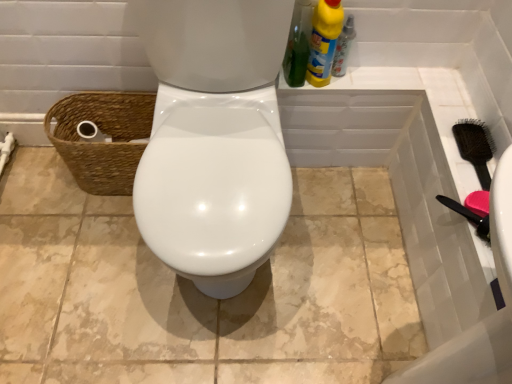
Locate an element on the screen. yellow plastic bottle at upper right is located at coordinates (343, 48).

In order to face yellow plastic bottle at upper right, placed as the first cleaning product when sorted from right to left, should I rotate leftwards or rightwards?

You should look right and rotate roughly 9.070 degrees.

Measure the distance between yellow plastic bottle at upper right, placed as the 2th cleaning product when sorted from left to right, and camera.

yellow plastic bottle at upper right, placed as the 2th cleaning product when sorted from left to right, and camera are 1.06 meters apart from each other.

The width and height of the screenshot is (512, 384). Describe the element at coordinates (298, 44) in the screenshot. I see `yellow liquid cleaner at upper right, which is the first cleaning product in left-to-right order` at that location.

You are a GUI agent. You are given a task and a screenshot of the screen. Output one action in this format:
    pyautogui.click(x=<x>, y=<y>)
    Task: Click on the yellow plastic bottle at upper right
    This screenshot has width=512, height=384.
    Given the screenshot: What is the action you would take?
    pyautogui.click(x=343, y=48)

Is yellow liquid cleaner at upper right, which is the first cleaning product in left-to-right order, oriented towards black plastic brush at right?

No, yellow liquid cleaner at upper right, which is the first cleaning product in left-to-right order, is not aimed at black plastic brush at right.

Considering the relative sizes of yellow liquid cleaner at upper right, which is the 2th cleaning product from right to left, and black plastic brush at right in the image provided, is yellow liquid cleaner at upper right, which is the 2th cleaning product from right to left, bigger than black plastic brush at right?

Yes, yellow liquid cleaner at upper right, which is the 2th cleaning product from right to left, is bigger than black plastic brush at right.

Would you say yellow liquid cleaner at upper right, which is the first cleaning product in left-to-right order, contains black plastic brush at right?

No, black plastic brush at right is not a part of yellow liquid cleaner at upper right, which is the first cleaning product in left-to-right order.

Is yellow liquid cleaner at upper right, which is the 2th cleaning product from right to left, positioned far away from black plastic brush at right?

No, there isn't a large distance between yellow liquid cleaner at upper right, which is the 2th cleaning product from right to left, and black plastic brush at right.

In the scene shown: Considering the positions of objects brown woven basket at left and yellow plastic bottle at upper right, placed as the first cleaning product when sorted from right to left, in the image provided, who is more to the left, brown woven basket at left or yellow plastic bottle at upper right, placed as the first cleaning product when sorted from right to left,?

From the viewer's perspective, brown woven basket at left appears more on the left side.

What's the angular difference between brown woven basket at left and yellow plastic bottle at upper right, placed as the first cleaning product when sorted from right to left,'s facing directions?

There is a 0.00104-degree angle between the facing directions of brown woven basket at left and yellow plastic bottle at upper right, placed as the first cleaning product when sorted from right to left.

In the scene shown: Does brown woven basket at left have a smaller size compared to yellow plastic bottle at upper right, placed as the 2th cleaning product when sorted from left to right?

Incorrect, brown woven basket at left is not smaller in size than yellow plastic bottle at upper right, placed as the 2th cleaning product when sorted from left to right.

Could yellow plastic bottle at upper right, placed as the 2th cleaning product when sorted from left to right, be considered to be inside brown woven basket at left?

No, yellow plastic bottle at upper right, placed as the 2th cleaning product when sorted from left to right, is located outside of brown woven basket at left.

Is yellow plastic bottle at upper right taller than yellow liquid cleaner at upper right, which is the 2th cleaning product from right to left?

No.

The width and height of the screenshot is (512, 384). What are the coordinates of `cleaning product that is the 2nd object located in front of the yellow plastic bottle at upper right` in the screenshot? It's located at (298, 44).

Is yellow plastic bottle at upper right bigger than yellow liquid cleaner at upper right, which is the first cleaning product in left-to-right order?

Actually, yellow plastic bottle at upper right might be smaller than yellow liquid cleaner at upper right, which is the first cleaning product in left-to-right order.

Measure the distance between yellow plastic bottle at upper right and yellow liquid cleaner at upper right, which is the 2th cleaning product from right to left.

yellow plastic bottle at upper right is 4.17 inches from yellow liquid cleaner at upper right, which is the 2th cleaning product from right to left.

What's the angular difference between brown woven basket at left and black plastic brush at right's facing directions?

The angle between the facing direction of brown woven basket at left and the facing direction of black plastic brush at right is 90.3 degrees.

From the image's perspective, which object appears higher, brown woven basket at left or black plastic brush at right?

From the image's view, brown woven basket at left is above.

Identify the location of brush located below the brown woven basket at left (from the image's perspective). (475, 147).

Who is taller, brown woven basket at left or black plastic brush at right?

brown woven basket at left.

Is black plastic brush at right positioned with its back to yellow plastic bottle at upper right?

No, black plastic brush at right is not facing the opposite direction of yellow plastic bottle at upper right.

Which is behind, point (475, 148) or point (335, 50)?

Positioned behind is point (335, 50).

Is black plastic brush at right situated inside yellow plastic bottle at upper right or outside?

black plastic brush at right is outside yellow plastic bottle at upper right.

Does brown woven basket at left appear on the right side of yellow plastic bottle at upper right?

No.

Between point (99, 105) and point (340, 64), which one is positioned in front?

Positioned in front is point (340, 64).

From the image's perspective, which object appears higher, brown woven basket at left or yellow plastic bottle at upper right?

yellow plastic bottle at upper right is shown above in the image.

From a real-world perspective, which is physically below, brown woven basket at left or yellow plastic bottle at upper right?

brown woven basket at left, from a real-world perspective.

Is yellow plastic bottle at upper right, placed as the first cleaning product when sorted from right to left, oriented away from yellow plastic bottle at upper right?

No, yellow plastic bottle at upper right, placed as the first cleaning product when sorted from right to left,'s orientation is not away from yellow plastic bottle at upper right.

From a real-world perspective, is yellow plastic bottle at upper right, placed as the first cleaning product when sorted from right to left, on yellow plastic bottle at upper right?

Yes, from a real-world perspective, yellow plastic bottle at upper right, placed as the first cleaning product when sorted from right to left, is above yellow plastic bottle at upper right.

Are yellow plastic bottle at upper right, placed as the 2th cleaning product when sorted from left to right, and yellow plastic bottle at upper right beside each other?

Yes, yellow plastic bottle at upper right, placed as the 2th cleaning product when sorted from left to right, is next to yellow plastic bottle at upper right.

Is yellow plastic bottle at upper right, placed as the 2th cleaning product when sorted from left to right, located outside yellow plastic bottle at upper right?

yellow plastic bottle at upper right, placed as the 2th cleaning product when sorted from left to right, is positioned outside yellow plastic bottle at upper right.

Where is `the 2nd cleaning product in front when counting from the black plastic brush at right`? This screenshot has height=384, width=512. the 2nd cleaning product in front when counting from the black plastic brush at right is located at coordinates (298, 44).

This screenshot has width=512, height=384. I want to click on basket below the yellow plastic bottle at upper right, placed as the 2th cleaning product when sorted from left to right (from the image's perspective), so click(102, 143).

Considering their positions, is yellow liquid cleaner at upper right, which is the 2th cleaning product from right to left, positioned closer to brown woven basket at left than yellow plastic bottle at upper right?

Based on the image, yellow liquid cleaner at upper right, which is the 2th cleaning product from right to left, appears to be nearer to brown woven basket at left.

Considering their positions, is black plastic brush at right positioned closer to yellow liquid cleaner at upper right, which is the 2th cleaning product from right to left, than yellow plastic bottle at upper right, placed as the 2th cleaning product when sorted from left to right?

yellow plastic bottle at upper right, placed as the 2th cleaning product when sorted from left to right, is closer to yellow liquid cleaner at upper right, which is the 2th cleaning product from right to left.

Consider the image. Considering their positions, is brown woven basket at left positioned closer to yellow plastic bottle at upper right, placed as the 2th cleaning product when sorted from left to right, than yellow liquid cleaner at upper right, which is the first cleaning product in left-to-right order?

yellow liquid cleaner at upper right, which is the first cleaning product in left-to-right order.

When comparing their distances from yellow liquid cleaner at upper right, which is the 2th cleaning product from right to left, does yellow plastic bottle at upper right or yellow plastic bottle at upper right, placed as the 2th cleaning product when sorted from left to right, seem closer?

Result: yellow plastic bottle at upper right, placed as the 2th cleaning product when sorted from left to right, is closer to yellow liquid cleaner at upper right, which is the 2th cleaning product from right to left.

Estimate the real-world distances between objects in this image. Which object is further from yellow plastic bottle at upper right, placed as the first cleaning product when sorted from right to left, yellow plastic bottle at upper right or black plastic brush at right?

black plastic brush at right is further to yellow plastic bottle at upper right, placed as the first cleaning product when sorted from right to left.

Based on their spatial positions, is brown woven basket at left or yellow plastic bottle at upper right, placed as the 2th cleaning product when sorted from left to right, closer to black plastic brush at right?

yellow plastic bottle at upper right, placed as the 2th cleaning product when sorted from left to right, lies closer to black plastic brush at right than the other object.

Based on the photo, looking at the image, which one is located closer to brown woven basket at left, yellow plastic bottle at upper right or yellow plastic bottle at upper right, placed as the 2th cleaning product when sorted from left to right?

Based on the image, yellow plastic bottle at upper right, placed as the 2th cleaning product when sorted from left to right, appears to be nearer to brown woven basket at left.

Which object lies nearer to the anchor point black plastic brush at right, yellow plastic bottle at upper right or yellow liquid cleaner at upper right, which is the first cleaning product in left-to-right order?

yellow plastic bottle at upper right lies closer to black plastic brush at right than the other object.

Where is `cleaning product situated between brown woven basket at left and yellow plastic bottle at upper right, placed as the first cleaning product when sorted from right to left, from left to right`? cleaning product situated between brown woven basket at left and yellow plastic bottle at upper right, placed as the first cleaning product when sorted from right to left, from left to right is located at coordinates (298, 44).

The image size is (512, 384). I want to click on bottle between yellow plastic bottle at upper right, placed as the first cleaning product when sorted from right to left, and black plastic brush at right, in the horizontal direction, so click(343, 48).

At what (x,y) coordinates should I click in order to perform the action: click on bottle located between brown woven basket at left and black plastic brush at right in the left-right direction. Please return your answer as a coordinate pair (x, y). Image resolution: width=512 pixels, height=384 pixels. Looking at the image, I should click on (343, 48).

The height and width of the screenshot is (384, 512). I want to click on cleaning product positioned between yellow liquid cleaner at upper right, which is the 2th cleaning product from right to left, and yellow plastic bottle at upper right from near to far, so click(x=324, y=41).